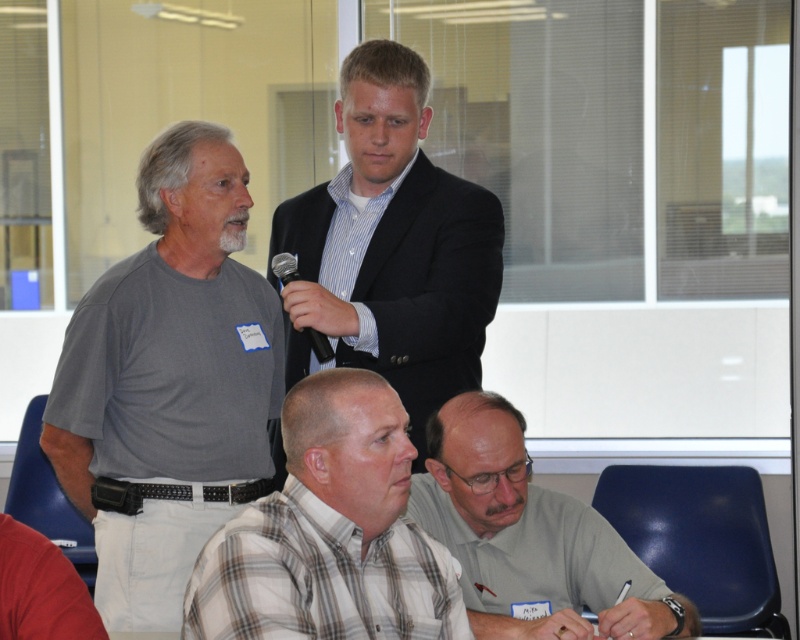
You are organizing a photoshoot and need to adjust the lighting setup. The matte black suit at center is blocking the light reaching the plaid cotton shirt at lower center. How can you position the lights to ensure both are well lit?

Since the plaid cotton shirt at lower center is behind the matte black suit at center, you can position the lights behind the matte black suit at center to cast light forward onto both the suit and the shirt behind it.

You are standing at the entrance of the conference room and want to approach the person wearing the matte black suit at center. Based on the coordinates provided, in which direction should you move relative to your current position?

The matte black suit at center is located at coordinates point (392, 246), so you should move towards the center of the room to reach them.